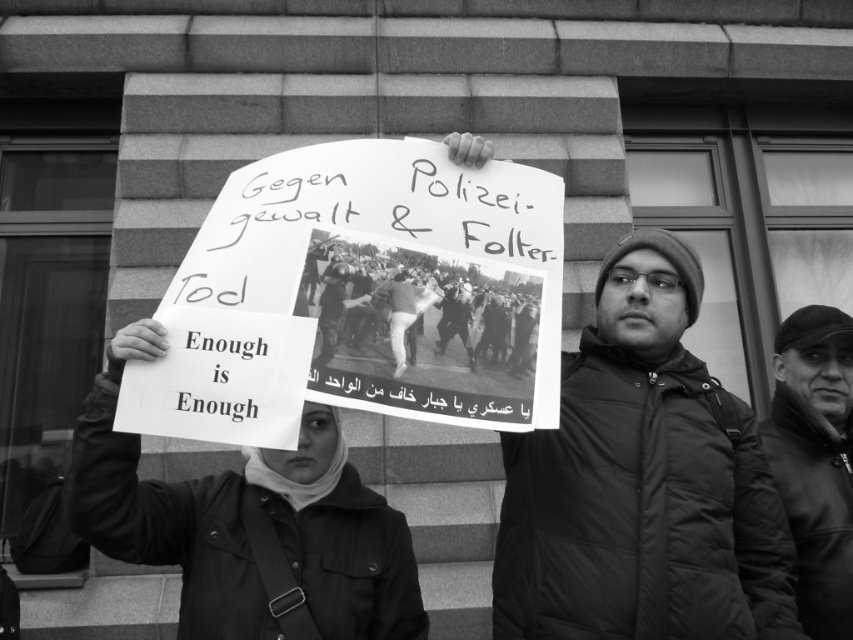
Question: Which point appears farthest from the camera in this image?

Choices:
 (A) (833, 406)
 (B) (602, 627)

Answer: (A)

Question: Can you confirm if matte black jacket at center is smaller than dark fabric jacket at center?

Choices:
 (A) yes
 (B) no

Answer: (B)

Question: Which object appears closest to the camera in this image?

Choices:
 (A) matte black jacket at center
 (B) dark fabric jacket at center

Answer: (A)

Question: Does matte black jacket at center have a lesser width compared to dark fabric jacket at center?

Choices:
 (A) no
 (B) yes

Answer: (A)

Question: Is matte black jacket at center smaller than dark fabric jacket at center?

Choices:
 (A) no
 (B) yes

Answer: (A)

Question: Which point is farther from the camera taking this photo?

Choices:
 (A) (502, 515)
 (B) (811, 618)

Answer: (B)